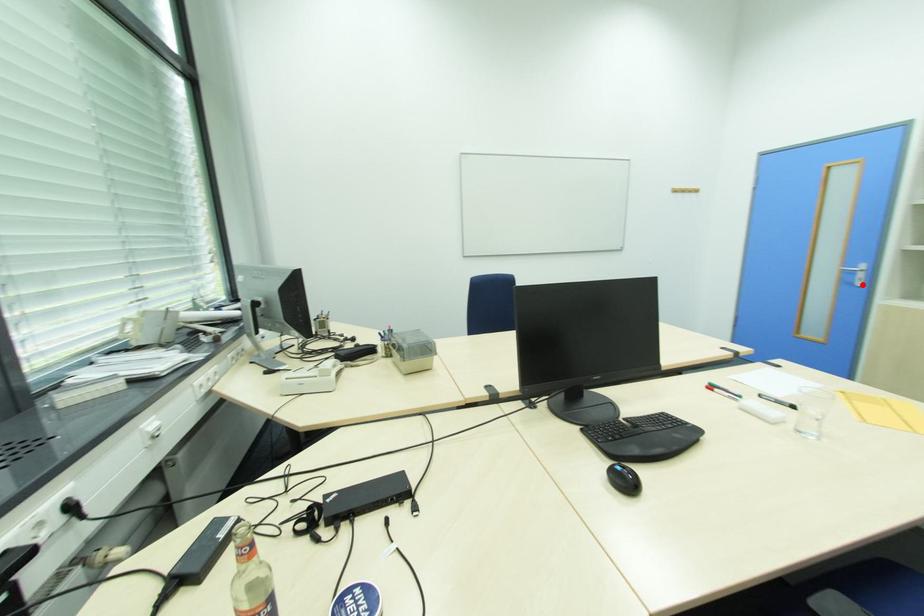
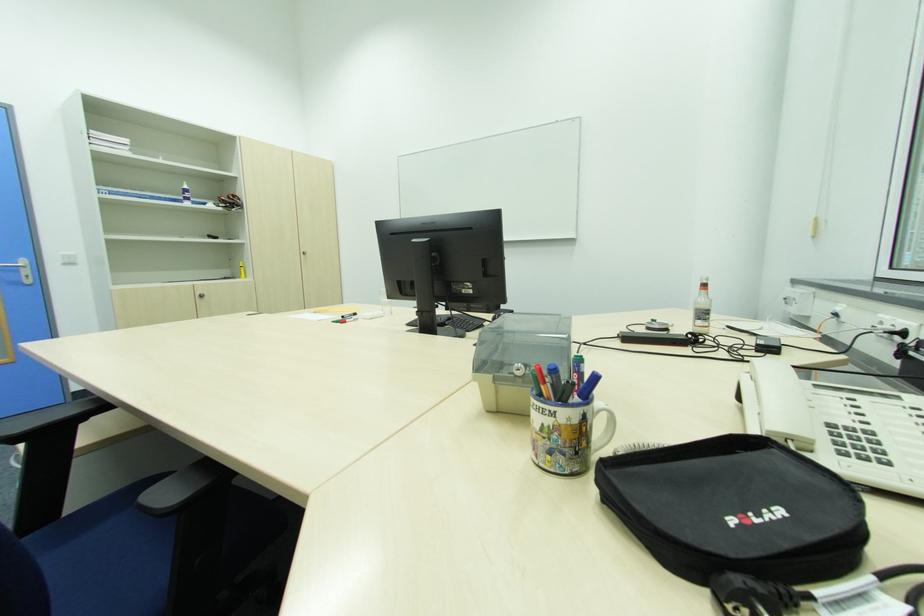
Question: I am providing you with two images of the same scene from different viewpoints. Given a red point in image1, look at the same physical point in image2. Is it:

Choices:
 (A) Closer to the viewpoint
 (B) Farther from the viewpoint

Answer: (A)